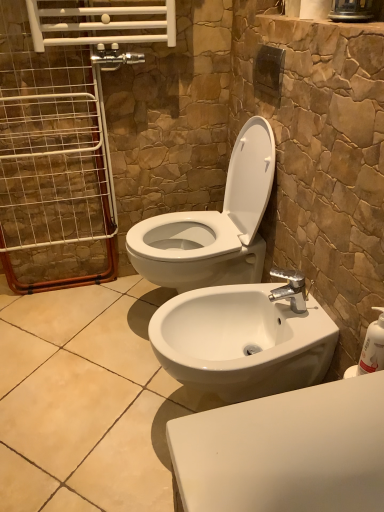
Question: Is white wire screen door at left placed right next to white glossy toilet at center?

Choices:
 (A) yes
 (B) no

Answer: (B)

Question: Does white wire screen door at left turn towards white glossy toilet at center?

Choices:
 (A) yes
 (B) no

Answer: (B)

Question: Does white wire screen door at left have a greater height compared to white glossy toilet at center?

Choices:
 (A) no
 (B) yes

Answer: (B)

Question: From a real-world perspective, is white wire screen door at left beneath white glossy toilet at center?

Choices:
 (A) yes
 (B) no

Answer: (B)

Question: Can you confirm if white wire screen door at left is wider than white glossy toilet at center?

Choices:
 (A) yes
 (B) no

Answer: (B)

Question: Considering the relative sizes of white wire screen door at left and white glossy toilet at center in the image provided, is white wire screen door at left thinner than white glossy toilet at center?

Choices:
 (A) yes
 (B) no

Answer: (A)

Question: Can you confirm if white plastic soap dispenser at right is bigger than white glossy toilet at center?

Choices:
 (A) no
 (B) yes

Answer: (A)

Question: Can you confirm if white plastic soap dispenser at right is smaller than white glossy toilet at center?

Choices:
 (A) no
 (B) yes

Answer: (B)

Question: From the image's perspective, is white plastic soap dispenser at right located beneath white glossy toilet at center?

Choices:
 (A) no
 (B) yes

Answer: (B)

Question: Does white plastic soap dispenser at right have a lesser width compared to white glossy toilet at center?

Choices:
 (A) no
 (B) yes

Answer: (B)

Question: Is white plastic soap dispenser at right turned away from white glossy toilet at center?

Choices:
 (A) yes
 (B) no

Answer: (B)

Question: Is the position of white plastic soap dispenser at right less distant than that of white glossy toilet at center?

Choices:
 (A) yes
 (B) no

Answer: (A)

Question: Does white glossy toilet at center have a smaller size compared to white plastic soap dispenser at right?

Choices:
 (A) yes
 (B) no

Answer: (B)